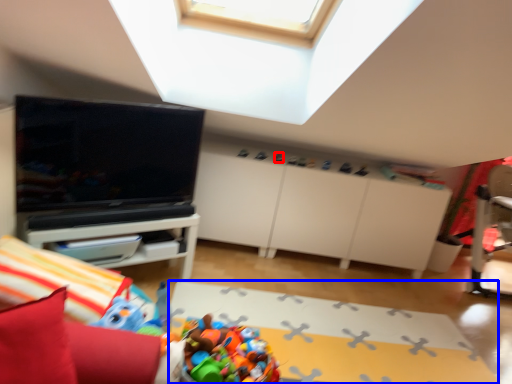
Question: Which point is further to the camera, toy (highlighted by a red box) or plain (highlighted by a blue box)?

Choices:
 (A) toy
 (B) plain

Answer: (A)